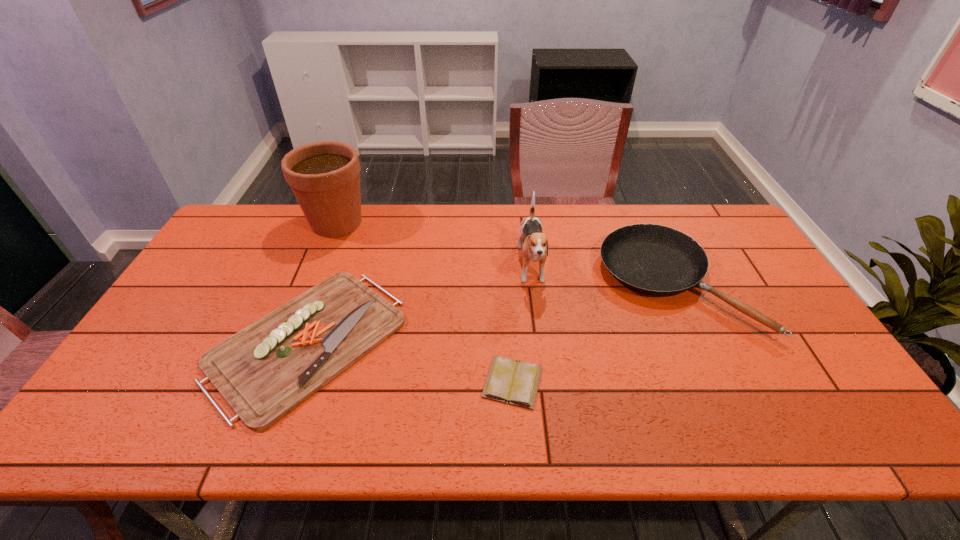
Image resolution: width=960 pixels, height=540 pixels. I want to click on vacant space located on the right of the shortest object, so click(x=680, y=382).

Identify the location of flowerpot present at the far edge. The height and width of the screenshot is (540, 960). (324, 176).

Where is `puppy at the far edge`? The image size is (960, 540). puppy at the far edge is located at coordinates (535, 248).

At what (x,y) coordinates should I click in order to perform the action: click on frying pan that is positioned at the far edge. Please return your answer as a coordinate pair (x, y). Looking at the image, I should click on (657, 260).

This screenshot has height=540, width=960. I want to click on chopping board present at the near edge, so click(x=264, y=371).

The width and height of the screenshot is (960, 540). Find the location of `diary that is at the near edge`. diary that is at the near edge is located at coordinates (513, 382).

Locate an element on the screen. The width and height of the screenshot is (960, 540). object that is at the right edge is located at coordinates (657, 260).

Locate an element on the screen. Image resolution: width=960 pixels, height=540 pixels. object that is at the far right corner is located at coordinates (657, 260).

The height and width of the screenshot is (540, 960). In the image, there is a desktop. Identify the location of vacant space at the far edge. (432, 238).

In the image, there is a desktop. Where is `free region at the near edge`? free region at the near edge is located at coordinates pos(560,438).